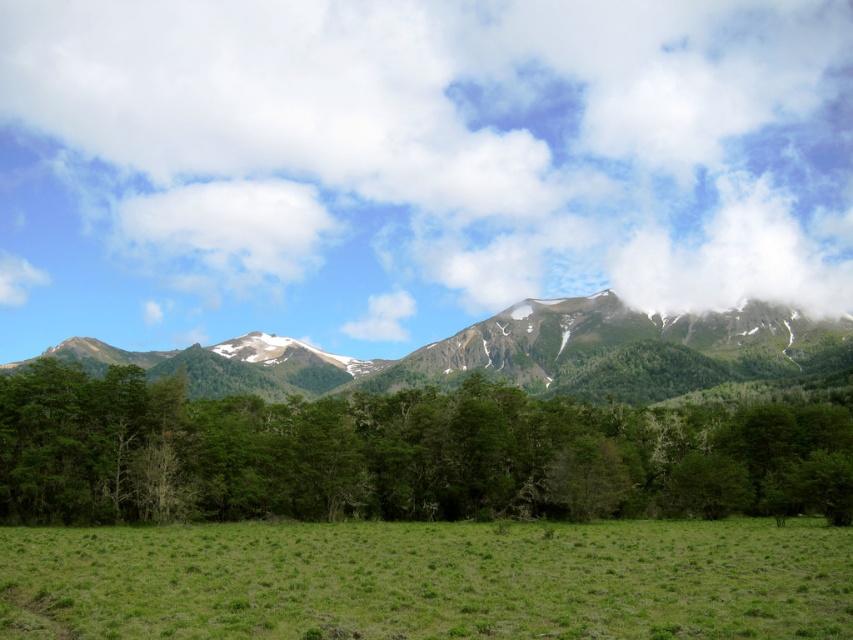
Is white fluffy cloud at upper center to the left of green textured mountain range at center from the viewer's perspective?

Yes, white fluffy cloud at upper center is to the left of green textured mountain range at center.

Who is more forward, (12, 4) or (283, 384)?

Positioned in front is point (283, 384).

Which is behind, point (96, 64) or point (755, 339)?

Positioned behind is point (96, 64).

Find the location of a particular element. Image resolution: width=853 pixels, height=640 pixels. white fluffy cloud at upper center is located at coordinates (412, 164).

Is green leafy tree at center below green textured mountain range at center?

Incorrect, green leafy tree at center is not positioned below green textured mountain range at center.

Between green leafy tree at center and green textured mountain range at center, which one has less height?

green leafy tree at center is shorter.

Who is more forward, (x=343, y=451) or (x=172, y=353)?

Point (x=343, y=451) is in front.

The width and height of the screenshot is (853, 640). I want to click on green leafy tree at center, so click(399, 454).

At what (x,y) coordinates should I click in order to perform the action: click on white fluffy cloud at upper center. Please return your answer as a coordinate pair (x, y). This screenshot has width=853, height=640. Looking at the image, I should click on (412, 164).

Does white fluffy cloud at upper center have a greater width compared to green grassy field at lower center?

Yes.

At what (x,y) coordinates should I click in order to perform the action: click on white fluffy cloud at upper center. Please return your answer as a coordinate pair (x, y). Looking at the image, I should click on (412, 164).

Locate an element on the screen. white fluffy cloud at upper center is located at coordinates (412, 164).